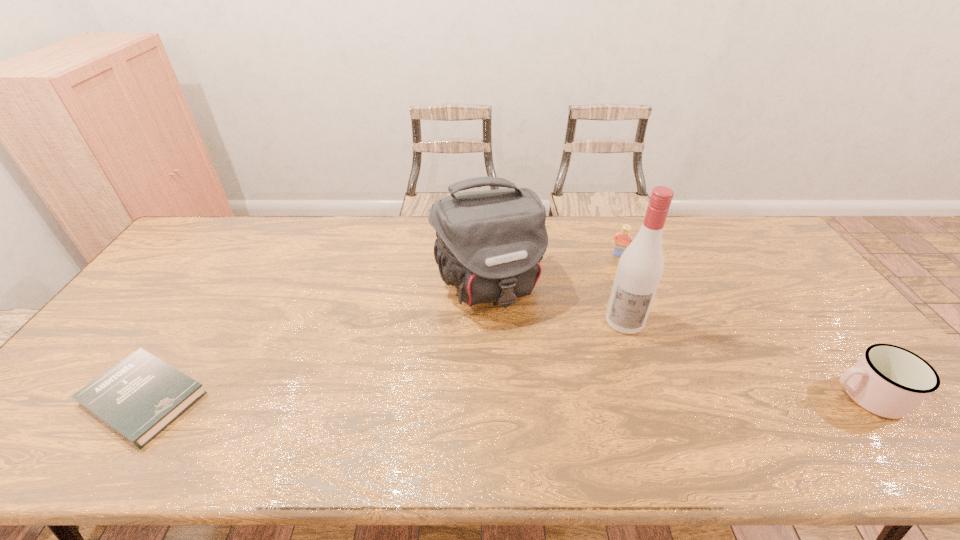
Select which object is the closest to the Lego. Please provide its 2D coordinates. Your answer should be formatted as a tuple, i.e. [(x, y)], where the tuple contains the x and y coordinates of a point satisfying the conditions above.

[(640, 268)]

I want to click on free point that satisfies the following two spatial constraints: 1. on the back side of the leftmost object; 2. on the left side of the Lego, so click(239, 255).

Find the location of a particular element. blank area in the image that satisfies the following two spatial constraints: 1. on the back side of the mug; 2. on the side of the book with the handle is located at coordinates (146, 396).